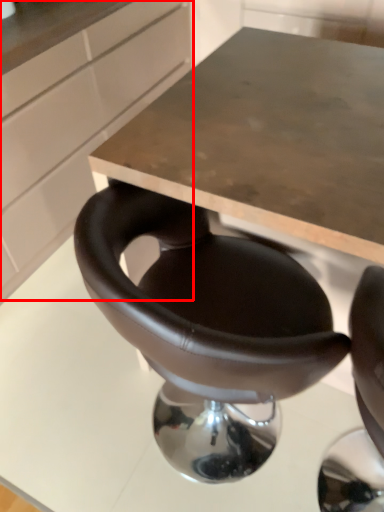
Question: From the image's perspective, where is cabinetry (annotated by the red box) located in relation to chair in the image?

Choices:
 (A) above
 (B) below

Answer: (A)